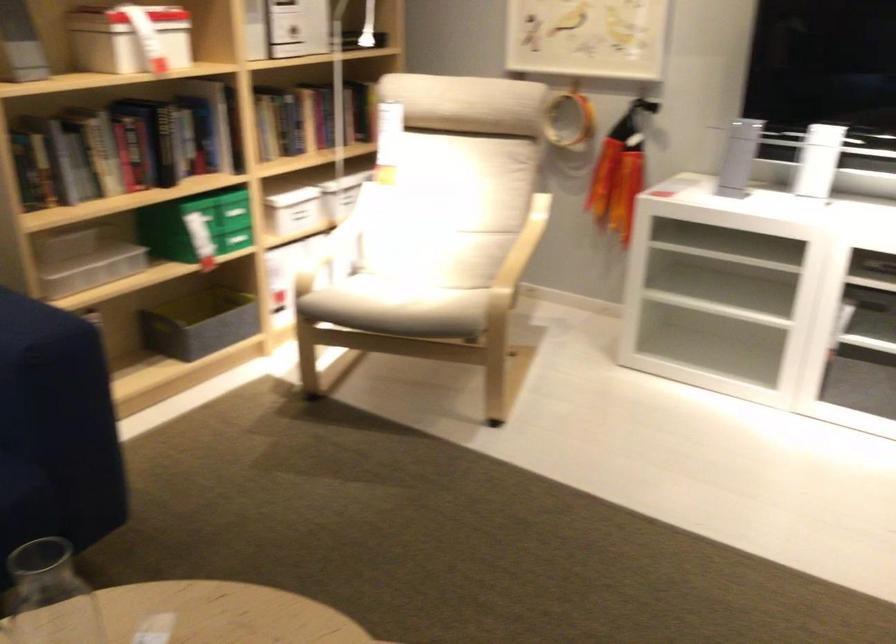
You are a GUI agent. You are given a task and a screenshot of the screen. Output one action in this format:
    pyautogui.click(x=<x>, y=<y>)
    Task: Click on the chair armrest
    This screenshot has width=896, height=644.
    Given the screenshot: What is the action you would take?
    pyautogui.click(x=536, y=223)